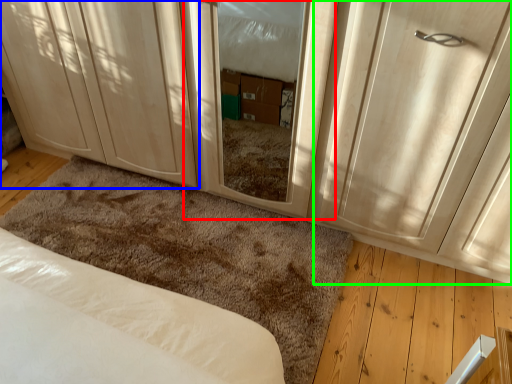
Question: Based on their relative distances, which object is nearer to screen door (highlighted by a red box)? Choose from cabinetry (highlighted by a blue box) and door (highlighted by a green box).

Choices:
 (A) cabinetry
 (B) door

Answer: (B)